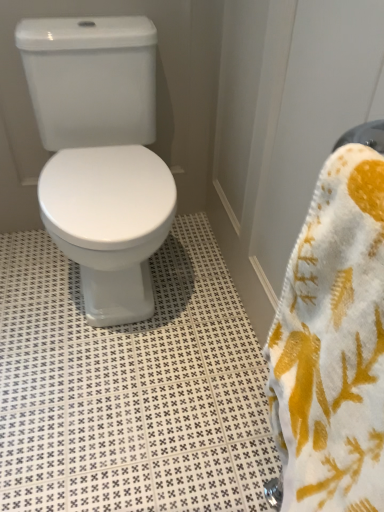
What do you see at coordinates (130, 387) in the screenshot?
I see `white textured tile at center` at bounding box center [130, 387].

At what (x,y) coordinates should I click in order to perform the action: click on white soft towel at right. Please return your answer as a coordinate pair (x, y). Looking at the image, I should click on (333, 343).

Consider the image. Is the surface of white soft towel at right in direct contact with white glossy toilet at center?

white soft towel at right and white glossy toilet at center are not in contact.

Between white soft towel at right and white glossy toilet at center, which one has less height?

Standing shorter between the two is white soft towel at right.

How many degrees apart are the facing directions of white soft towel at right and white glossy toilet at center?

There is a 88.5-degree angle between the facing directions of white soft towel at right and white glossy toilet at center.

Identify the location of toilet above the white textured tile at center (from the image's perspective). This screenshot has height=512, width=384. (100, 155).

From a real-world perspective, is white glossy toilet at center positioned over white textured tile at center based on gravity?

Correct, in the physical world, white glossy toilet at center is higher than white textured tile at center.

In the scene shown: Is white textured tile at center located within white glossy toilet at center?

No.

Is white textured tile at center not inside white soft towel at right?

Yes, white textured tile at center is not within white soft towel at right.

Does white textured tile at center lie behind white soft towel at right?

Yes, the depth of white textured tile at center is greater than that of white soft towel at right.

Considering the relative sizes of white textured tile at center and white soft towel at right in the image provided, is white textured tile at center shorter than white soft towel at right?

Indeed, white textured tile at center has a lesser height compared to white soft towel at right.

From a real-world perspective, does white textured tile at center sit lower than white soft towel at right?

Correct, in the physical world, white textured tile at center is lower than white soft towel at right.

Considering the positions of objects white soft towel at right and white textured tile at center in the image provided, who is behind, white soft towel at right or white textured tile at center?

white textured tile at center is behind.

Is white soft towel at right positioned with its back to white textured tile at center?

No, white soft towel at right is not facing the opposite direction of white textured tile at center.

Is white soft towel at right far from white textured tile at center?

That's not correct — white soft towel at right is a little close to white textured tile at center.

Is white soft towel at right outside of white textured tile at center?

white soft towel at right is positioned outside white textured tile at center.

The width and height of the screenshot is (384, 512). In the image, there is a white glossy toilet at center. Find the location of `tile below it (from the image's perspective)`. tile below it (from the image's perspective) is located at coordinates (130, 387).

Would you consider white textured tile at center to be distant from white glossy toilet at center?

No.

Is white textured tile at center bigger or smaller than white glossy toilet at center?

white textured tile at center is smaller than white glossy toilet at center.

Which object is thinner, white glossy toilet at center or white soft towel at right?

white soft towel at right is thinner.

Is white glossy toilet at center positioned in front of white soft towel at right?

No, it is behind white soft towel at right.

From the image's perspective, is white glossy toilet at center on top of white soft towel at right?

Yes, from the image's perspective, white glossy toilet at center is above white soft towel at right.

From a real-world perspective, is white glossy toilet at center positioned above or below white soft towel at right?

white glossy toilet at center is situated lower than white soft towel at right in the real world.

This screenshot has height=512, width=384. In order to click on towel on the right of white glossy toilet at center in this screenshot , I will do `click(333, 343)`.

The image size is (384, 512). In the image, there is a white glossy toilet at center. Identify the location of tile below it (from the image's perspective). (130, 387).

When comparing their distances from white textured tile at center, does white soft towel at right or white glossy toilet at center seem closer?

white glossy toilet at center.

Based on their spatial positions, is white glossy toilet at center or white textured tile at center further from white soft towel at right?

white glossy toilet at center is positioned further to the anchor white soft towel at right.

From the image, which object appears to be farther from white glossy toilet at center, white textured tile at center or white soft towel at right?

The object further to white glossy toilet at center is white soft towel at right.

When comparing their distances from white soft towel at right, does white textured tile at center or white glossy toilet at center seem closer?

Among the two, white textured tile at center is located nearer to white soft towel at right.

From the image, which object appears to be nearer to white textured tile at center, white glossy toilet at center or white soft towel at right?

Based on the image, white glossy toilet at center appears to be nearer to white textured tile at center.

Looking at the image, which one is located closer to white glossy toilet at center, white soft towel at right or white textured tile at center?

Based on the image, white textured tile at center appears to be nearer to white glossy toilet at center.

You are a GUI agent. You are given a task and a screenshot of the screen. Output one action in this format:
    pyautogui.click(x=<x>, y=<y>)
    Task: Click on the toilet between white soft towel at right and white textured tile at center along the z-axis
    Image resolution: width=384 pixels, height=512 pixels.
    Given the screenshot: What is the action you would take?
    pyautogui.click(x=100, y=155)